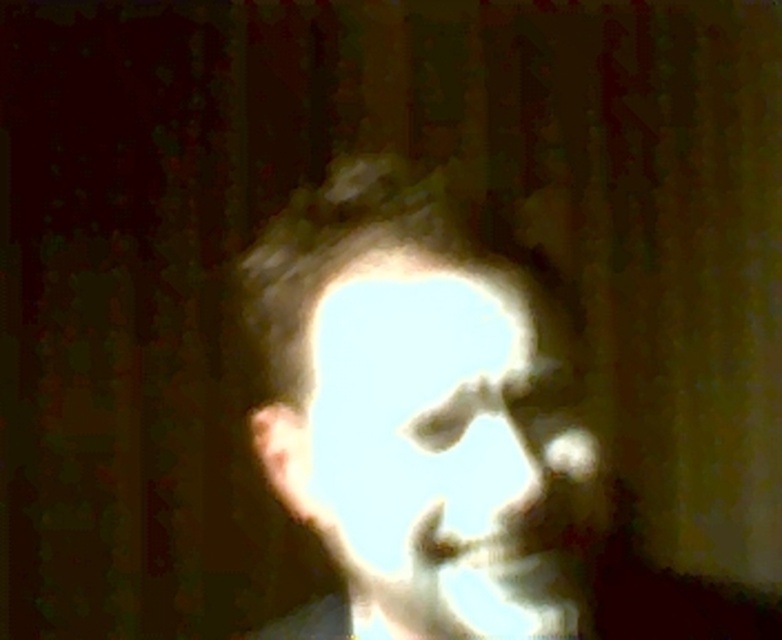
Question: Which of the following is the closest to the observer?

Choices:
 (A) (479, 349)
 (B) (296, 365)

Answer: (A)

Question: Can you confirm if light gray matte face at center is positioned to the left of translucent white face at center?

Choices:
 (A) no
 (B) yes

Answer: (A)

Question: Considering the relative positions of light gray matte face at center and translucent white face at center in the image provided, where is light gray matte face at center located with respect to translucent white face at center?

Choices:
 (A) above
 (B) below

Answer: (B)

Question: Which object appears closest to the camera in this image?

Choices:
 (A) translucent white face at center
 (B) light gray matte face at center

Answer: (A)

Question: Does light gray matte face at center appear over translucent white face at center?

Choices:
 (A) yes
 (B) no

Answer: (B)